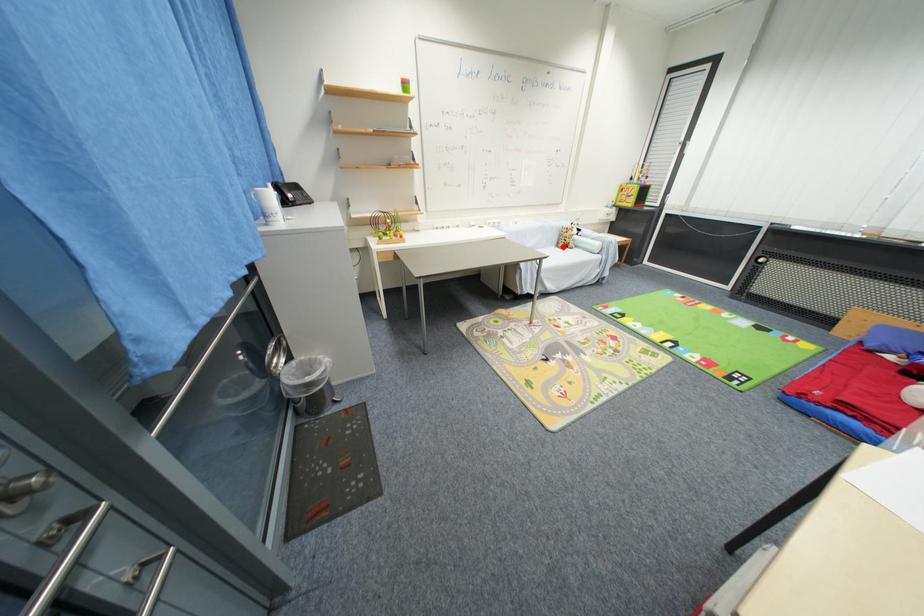
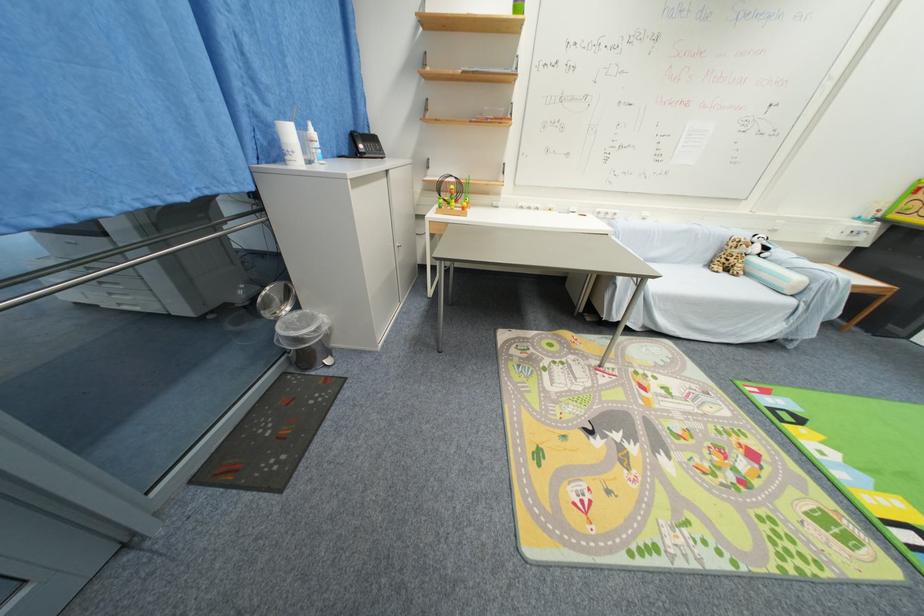
Question: I am providing you with two images of the same scene from different viewpoints. Image1 has a red point marked. In image2, the corresponding 3D location appears at what relative position? Reply with the corresponding letter.

Choices:
 (A) Closer
 (B) Farther

Answer: (A)